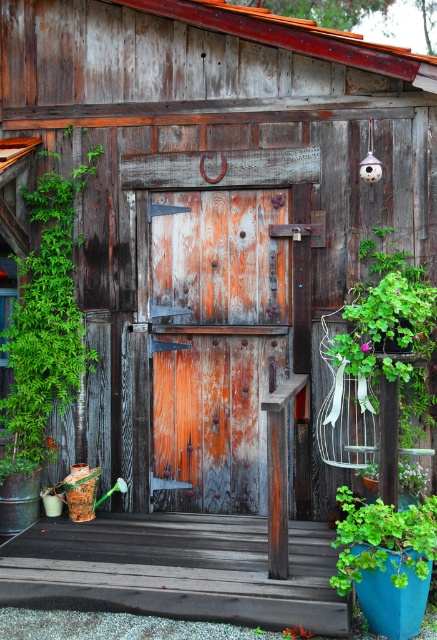
You are standing in front of the rustic wooden door and want to place a large potted plant on the dark brown wood porch at center. However, you also have a small decorative item to place on the green leafy plant at right. Based on their sizes, which object can accommodate the larger item?

The dark brown wood porch at center might be wider than green leafy plant at right, so the large potted plant should be placed on the dark brown wood porch at center and the small decorative item on the green leafy plant at right.

You are standing in front of the rustic wooden door and want to place a small potted plant on the dark brown wood porch at center. However, there is already a green leafy plant at right. Which surface is nearer to you where you can place the new plant?

The dark brown wood porch at center is closer to the viewer than the green leafy plant at right, so you can place the new plant on the dark brown wood porch at center.